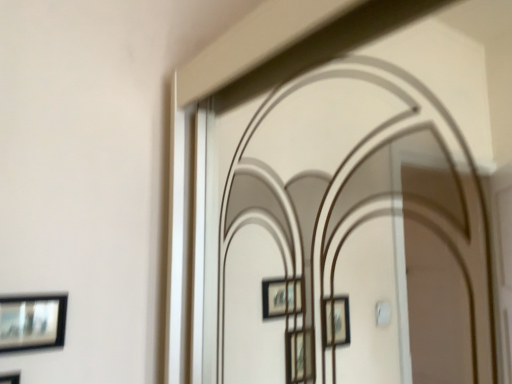
Question: From the image's perspective, relative to matte black picture frame at lower left, the 2th picture frame in the bottom-to-top sequence, is matte black picture frame at lower left, which appears as the 2th picture frame when viewed from the top, above or below?

Choices:
 (A) below
 (B) above

Answer: (A)

Question: Considering the positions of matte black picture frame at lower left, which appears as the 2th picture frame when viewed from the top, and matte black picture frame at lower left, the 2th picture frame in the bottom-to-top sequence, in the image, is matte black picture frame at lower left, which appears as the 2th picture frame when viewed from the top, wider or thinner than matte black picture frame at lower left, the 2th picture frame in the bottom-to-top sequence,?

Choices:
 (A) thin
 (B) wide

Answer: (B)

Question: From a real-world perspective, is matte black picture frame at lower left, which is the first picture frame in bottom-to-top order, positioned above or below matte black picture frame at lower left, the 2th picture frame in the bottom-to-top sequence?

Choices:
 (A) below
 (B) above

Answer: (A)

Question: Looking at their shapes, would you say matte black picture frame at lower left, the 2th picture frame in the bottom-to-top sequence, is wider or thinner than matte black picture frame at lower left, which appears as the 2th picture frame when viewed from the top?

Choices:
 (A) wide
 (B) thin

Answer: (B)

Question: Is matte black picture frame at lower left, placed as the 1th picture frame when sorted from top to bottom, in front of or behind matte black picture frame at lower left, which appears as the 2th picture frame when viewed from the top, in the image?

Choices:
 (A) front
 (B) behind

Answer: (B)

Question: Considering the relative positions of matte black picture frame at lower left, the 2th picture frame in the bottom-to-top sequence, and matte black picture frame at lower left, which is the first picture frame in bottom-to-top order, in the image provided, is matte black picture frame at lower left, the 2th picture frame in the bottom-to-top sequence, to the left or to the right of matte black picture frame at lower left, which is the first picture frame in bottom-to-top order,?

Choices:
 (A) left
 (B) right

Answer: (B)

Question: From the image's perspective, is matte black picture frame at lower left, placed as the 1th picture frame when sorted from top to bottom, located above or below matte black picture frame at lower left, which is the first picture frame in bottom-to-top order?

Choices:
 (A) above
 (B) below

Answer: (A)